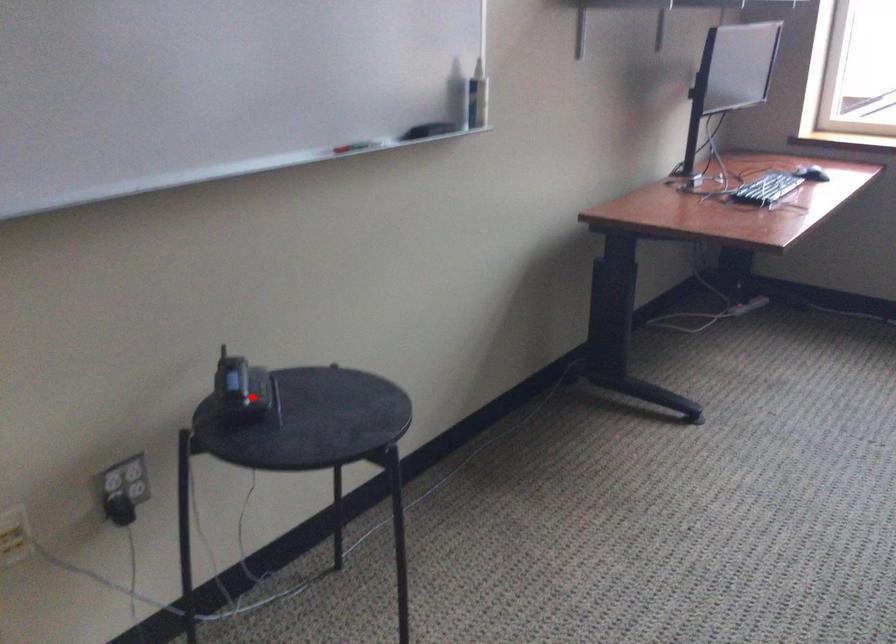
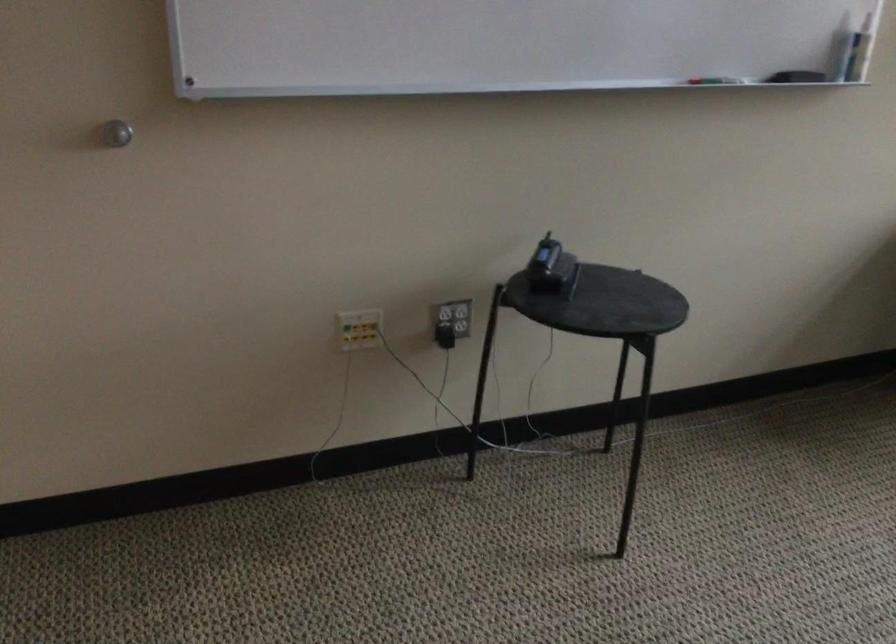
The point at the highlighted location is marked in the first image. Where is the corresponding point in the second image?

(550, 268)